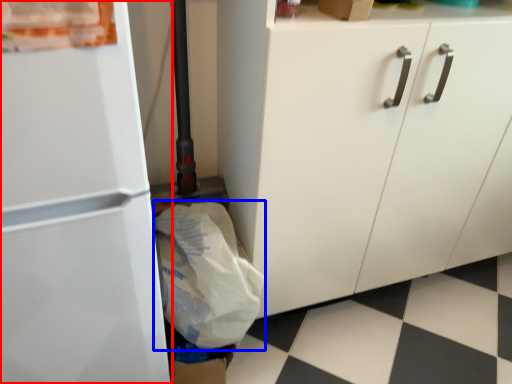
Question: Which of the following is the farthest to the observer, refrigerator (highlighted by a red box) or grocery bag (highlighted by a blue box)?

Choices:
 (A) refrigerator
 (B) grocery bag

Answer: (B)